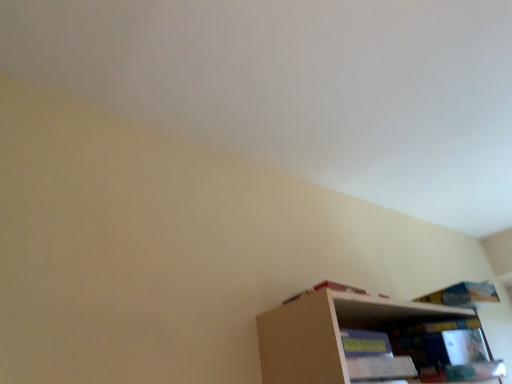
Question: From the image's perspective, would you say blue paper book at upper right, which appears as the 2th book when viewed from the left, is positioned over wooden bookshelf at lower right?

Choices:
 (A) no
 (B) yes

Answer: (B)

Question: Is blue paper book at upper right, marked as the first book in a back-to-front arrangement, smaller than wooden bookshelf at lower right?

Choices:
 (A) yes
 (B) no

Answer: (A)

Question: Does blue paper book at upper right, which appears as the 2th book when viewed from the left, have a greater height compared to wooden bookshelf at lower right?

Choices:
 (A) no
 (B) yes

Answer: (A)

Question: Considering the relative positions of blue paper book at upper right, which appears as the 2th book when viewed from the left, and wooden bookshelf at lower right in the image provided, is blue paper book at upper right, which appears as the 2th book when viewed from the left, behind wooden bookshelf at lower right?

Choices:
 (A) no
 (B) yes

Answer: (B)

Question: Considering the relative positions of blue paper book at upper right, placed as the second book when sorted from front to back, and wooden bookshelf at lower right in the image provided, is blue paper book at upper right, placed as the second book when sorted from front to back, to the left of wooden bookshelf at lower right from the viewer's perspective?

Choices:
 (A) yes
 (B) no

Answer: (B)

Question: Does blue paper book at upper right, which appears as the 2th book when viewed from the left, have a greater width compared to wooden bookshelf at lower right?

Choices:
 (A) yes
 (B) no

Answer: (B)

Question: Is wooden bookshelf at lower right wider than white cardboard book at upper right, acting as the 2th book starting from the right?

Choices:
 (A) no
 (B) yes

Answer: (B)

Question: Is wooden bookshelf at lower right not near white cardboard book at upper right, acting as the 2th book starting from the right?

Choices:
 (A) no
 (B) yes

Answer: (A)

Question: From a real-world perspective, is wooden bookshelf at lower right positioned under white cardboard book at upper right, which is the 2th book from back to front, based on gravity?

Choices:
 (A) yes
 (B) no

Answer: (A)

Question: Can you confirm if wooden bookshelf at lower right is thinner than white cardboard book at upper right, acting as the 2th book starting from the right?

Choices:
 (A) yes
 (B) no

Answer: (B)

Question: Does wooden bookshelf at lower right appear on the right side of white cardboard book at upper right, acting as the 2th book starting from the right?

Choices:
 (A) no
 (B) yes

Answer: (B)

Question: Is wooden bookshelf at lower right outside of white cardboard book at upper right, acting as the 2th book starting from the right?

Choices:
 (A) no
 (B) yes

Answer: (B)

Question: Can you confirm if wooden bookshelf at lower right is positioned to the left of blue paper book at upper right, which appears as the 2th book when viewed from the left?

Choices:
 (A) no
 (B) yes

Answer: (B)